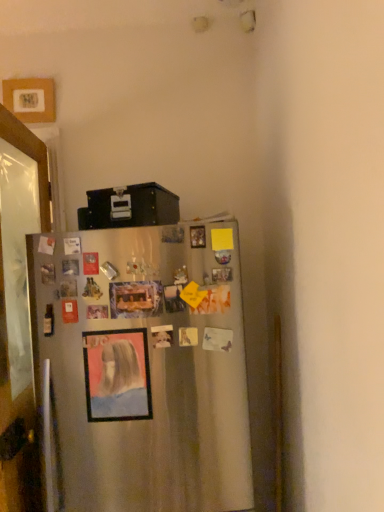
Question: Is matte plastic picture frame at center, marked as the second picture frame in a left-to-right arrangement, bigger than clear glass door at left?

Choices:
 (A) yes
 (B) no

Answer: (B)

Question: Considering the relative sizes of matte plastic picture frame at center, the 1th picture frame positioned from the bottom, and clear glass door at left in the image provided, is matte plastic picture frame at center, the 1th picture frame positioned from the bottom, wider than clear glass door at left?

Choices:
 (A) no
 (B) yes

Answer: (A)

Question: From the image's perspective, is matte plastic picture frame at center, the 1th picture frame positioned from the bottom, on top of clear glass door at left?

Choices:
 (A) yes
 (B) no

Answer: (A)

Question: From a real-world perspective, does matte plastic picture frame at center, arranged as the 2th picture frame when viewed from the back, stand above clear glass door at left?

Choices:
 (A) no
 (B) yes

Answer: (B)

Question: Does matte plastic picture frame at center, positioned as the 1th picture frame in front-to-back order, have a lesser width compared to clear glass door at left?

Choices:
 (A) no
 (B) yes

Answer: (B)

Question: Is clear glass door at left at the back of matte plastic picture frame at center, arranged as the 2th picture frame when viewed from the back?

Choices:
 (A) yes
 (B) no

Answer: (B)

Question: Is satin silver fridge at center positioned behind wooden picture frame at upper left, arranged as the 1th picture frame when viewed from the back?

Choices:
 (A) no
 (B) yes

Answer: (A)

Question: Is satin silver fridge at center looking in the opposite direction of wooden picture frame at upper left, which is the second picture frame in front-to-back order?

Choices:
 (A) yes
 (B) no

Answer: (B)

Question: Does satin silver fridge at center have a lesser height compared to wooden picture frame at upper left, marked as the 1th picture frame in a left-to-right arrangement?

Choices:
 (A) no
 (B) yes

Answer: (A)

Question: From a real-world perspective, is satin silver fridge at center below wooden picture frame at upper left, which is the second picture frame in front-to-back order?

Choices:
 (A) no
 (B) yes

Answer: (B)

Question: Is satin silver fridge at center with wooden picture frame at upper left, the second picture frame in the bottom-to-top sequence?

Choices:
 (A) yes
 (B) no

Answer: (B)

Question: Can you confirm if satin silver fridge at center is smaller than wooden picture frame at upper left, arranged as the 1th picture frame when viewed from the back?

Choices:
 (A) no
 (B) yes

Answer: (A)

Question: Considering the relative sizes of clear glass door at left and matte plastic picture frame at center, marked as the second picture frame in a left-to-right arrangement, in the image provided, is clear glass door at left taller than matte plastic picture frame at center, marked as the second picture frame in a left-to-right arrangement,?

Choices:
 (A) no
 (B) yes

Answer: (B)